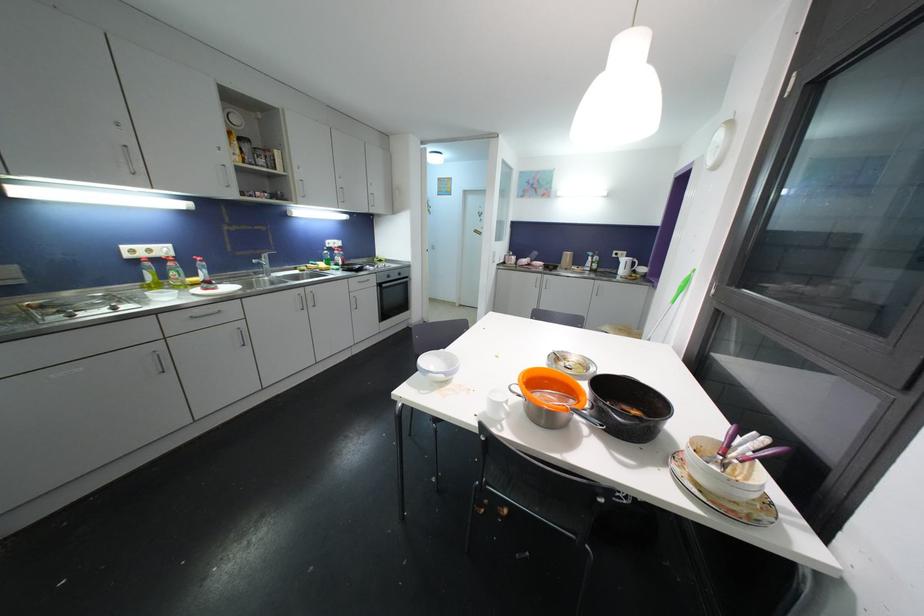
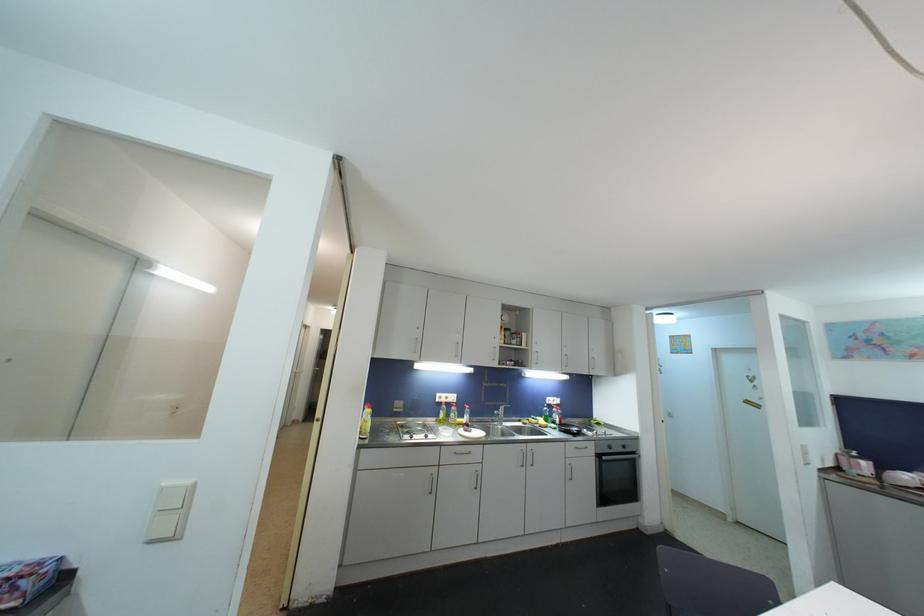
In the second image, find the point that corresponds to (x=130, y=257) in the first image.

(441, 403)